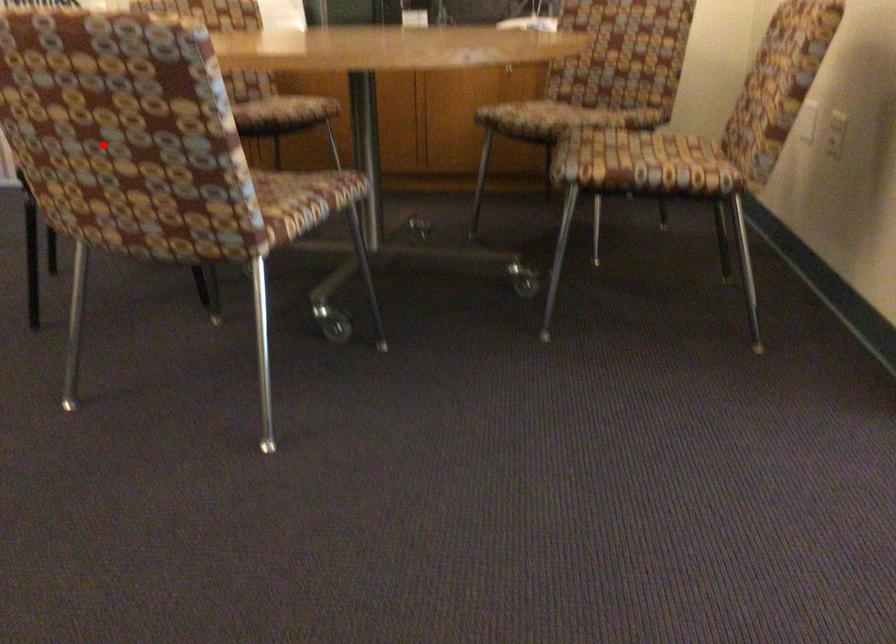
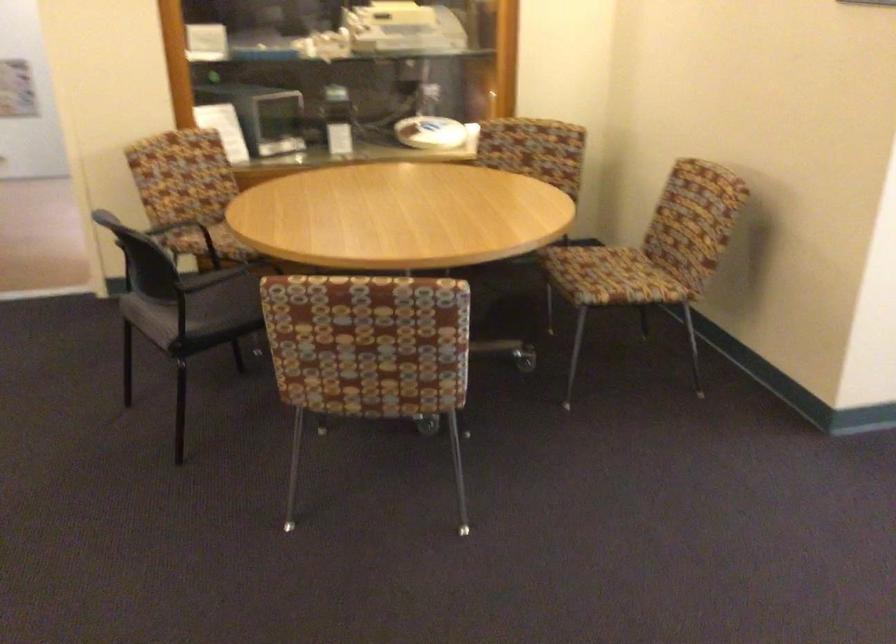
Question: I am providing you with two images of the same scene from different viewpoints. Image1 has a red point marked. In image2, the corresponding 3D location appears at what relative position? Reply with the corresponding letter.

Choices:
 (A) Closer
 (B) Farther

Answer: (B)